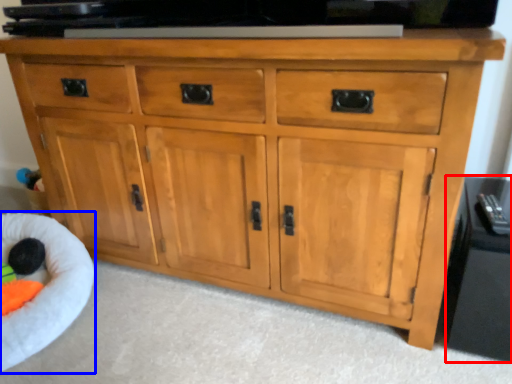
Question: Which of the following is the farthest to the observer, side cabinet (highlighted by a red box) or infant bed (highlighted by a blue box)?

Choices:
 (A) side cabinet
 (B) infant bed

Answer: (B)